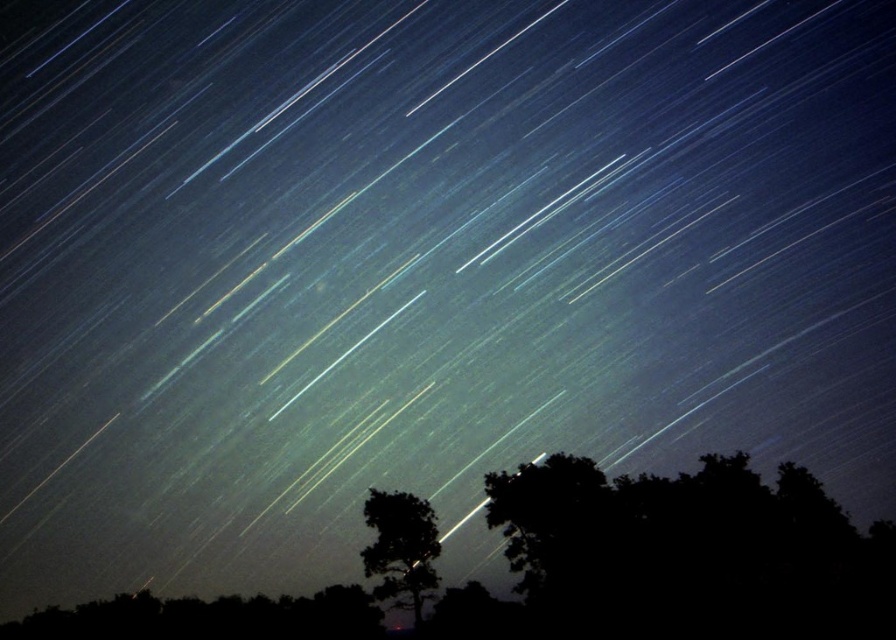
Who is positioned more to the right, black silhouetted tree at lower right or silhouette tree at center?

black silhouetted tree at lower right is more to the right.

Who is more distant from viewer, (527,557) or (395,552)?

The point (395,552) is behind.

This screenshot has height=640, width=896. In order to click on black silhouetted tree at lower right in this screenshot , I will do `click(692, 552)`.

You are a GUI agent. You are given a task and a screenshot of the screen. Output one action in this format:
    pyautogui.click(x=<x>, y=<y>)
    Task: Click on the black silhouetted tree at lower right
    
    Given the screenshot: What is the action you would take?
    pyautogui.click(x=692, y=552)